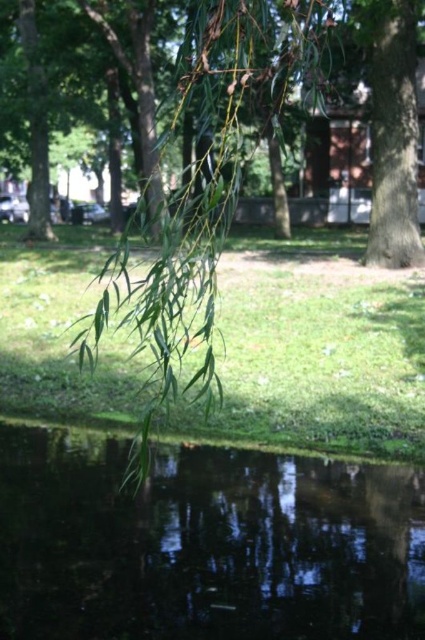
Which is behind, point (82, 481) or point (237, 321)?

The point (237, 321) is more distant.

Identify the location of transparent liquid water at lower center. The height and width of the screenshot is (640, 425). (204, 541).

The image size is (425, 640). Find the location of `transparent liquid water at lower center`. transparent liquid water at lower center is located at coordinates (204, 541).

Is green leafy grass at center below green leafy branch at lower left?

Indeed, green leafy grass at center is positioned under green leafy branch at lower left.

Between green leafy grass at center and green leafy branch at lower left, which one is positioned higher?

Positioned higher is green leafy branch at lower left.

Where is `green leafy grass at center`? green leafy grass at center is located at coordinates (316, 348).

Between transparent liquid water at lower center and green leafy branch at lower left, which one appears on the left side from the viewer's perspective?

transparent liquid water at lower center is more to the left.

You are a GUI agent. You are given a task and a screenshot of the screen. Output one action in this format:
    pyautogui.click(x=<x>, y=<y>)
    Task: Click on the transparent liquid water at lower center
    This screenshot has width=425, height=640.
    Given the screenshot: What is the action you would take?
    pyautogui.click(x=204, y=541)